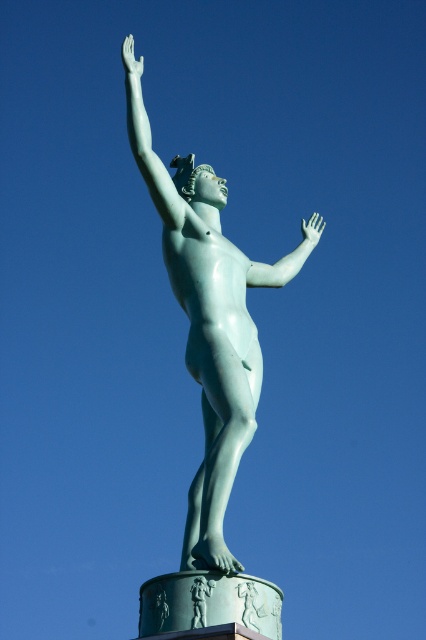
You are an art student analyzing the statue and its pedestal. You notice a specific point marked at coordinates (209, 602). Based on the scene, what does this point likely represent?

The point at (209, 602) marks the green polished stone pedestal at lower center, which serves as the base for the statue.

You are an art conservator examining the statue. You notice the green patina statue at center and the green polished statue arm at upper left. Which part of the statue is positioned higher up?

The green polished statue arm at upper left is positioned higher up than the green patina statue at center.